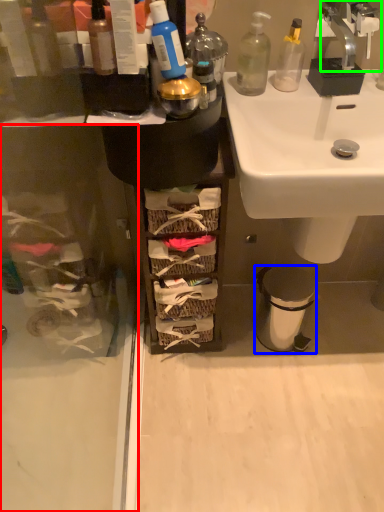
Question: Based on their relative distances, which object is farther from screen door (highlighted by a red box)? Choose from trash bin/can (highlighted by a blue box) and tap (highlighted by a green box).

Choices:
 (A) trash bin/can
 (B) tap

Answer: (B)